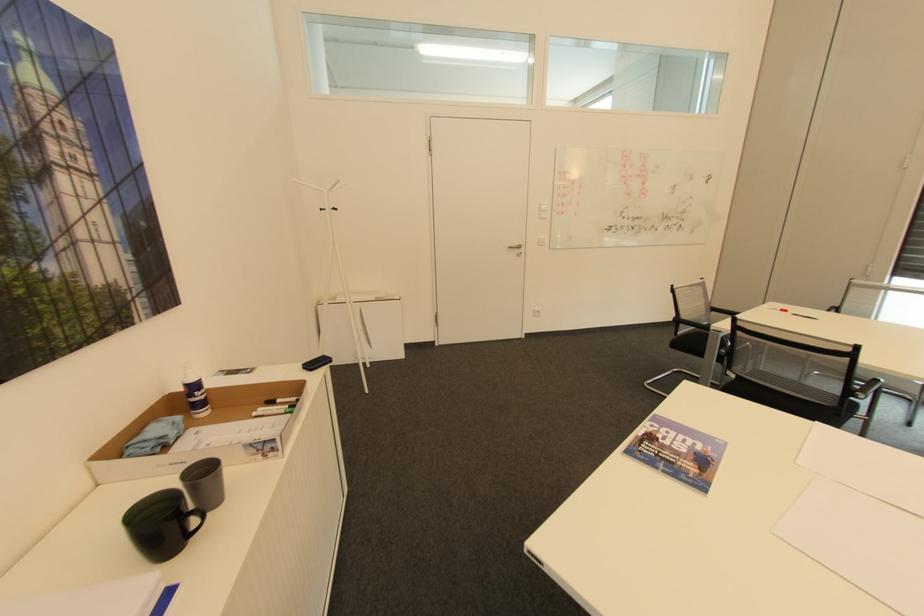
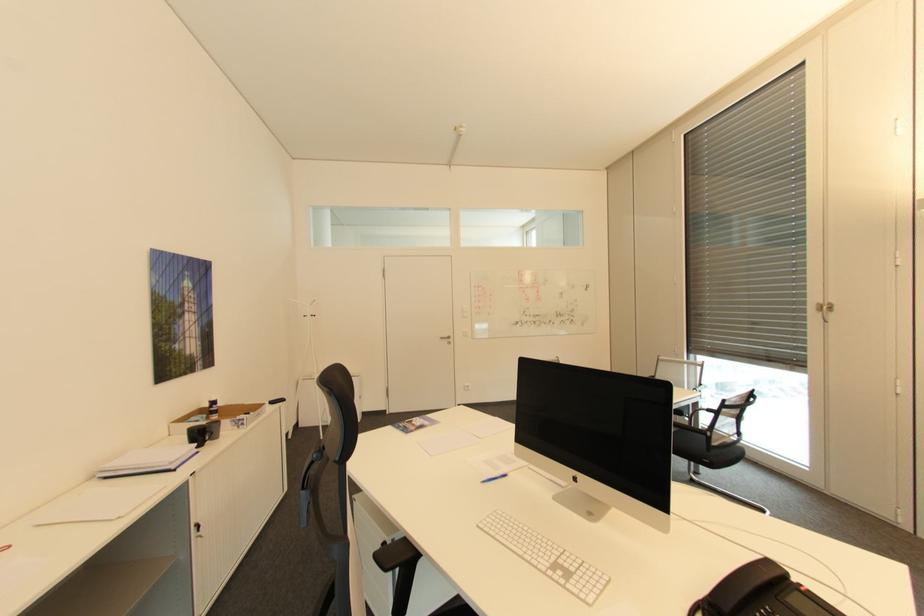
In a continuous first-person perspective shot, in which direction is the camera moving?

The cameraman walked toward right, backward.